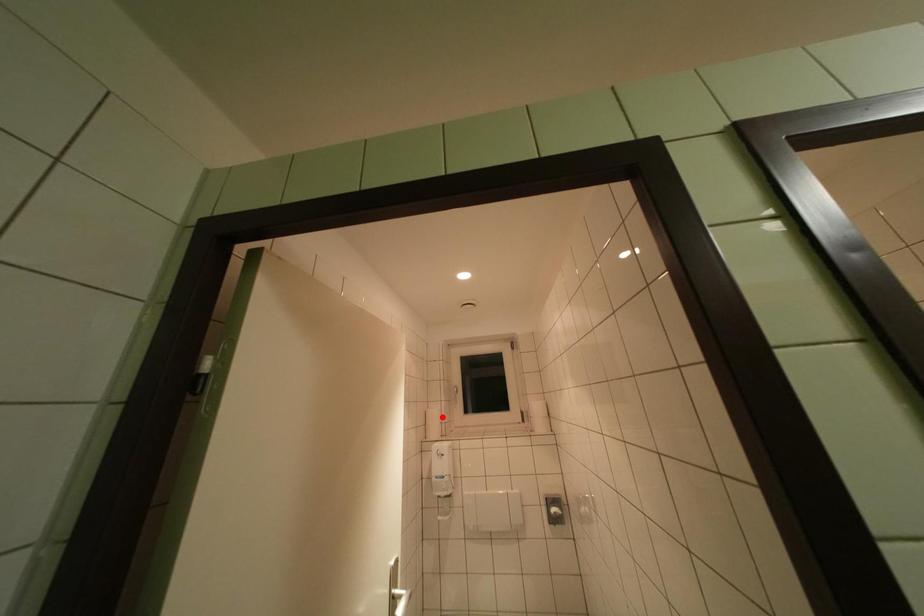
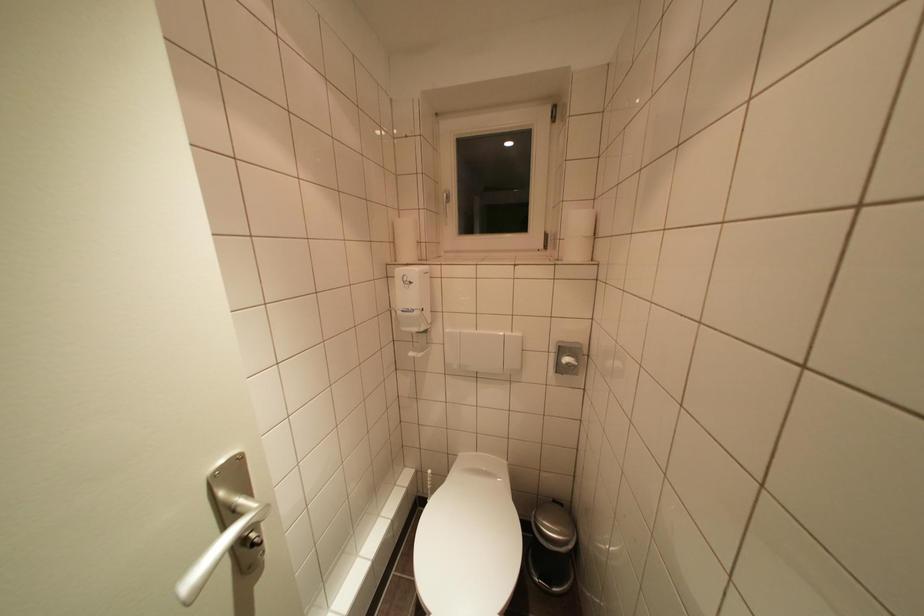
Where in the second image is the point corresponding to the highlighted location from the first image?

(416, 231)